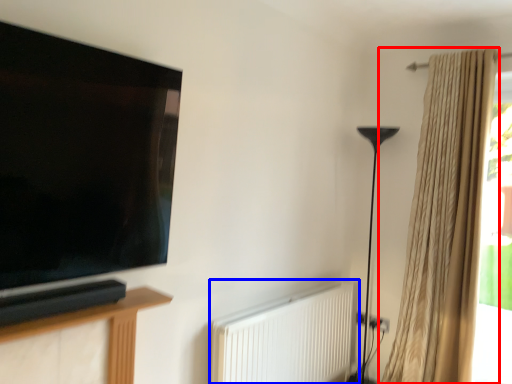
Question: Among these objects, which one is nearest to the camera, curtain (highlighted by a red box) or radiator (highlighted by a blue box)?

Choices:
 (A) curtain
 (B) radiator

Answer: (B)